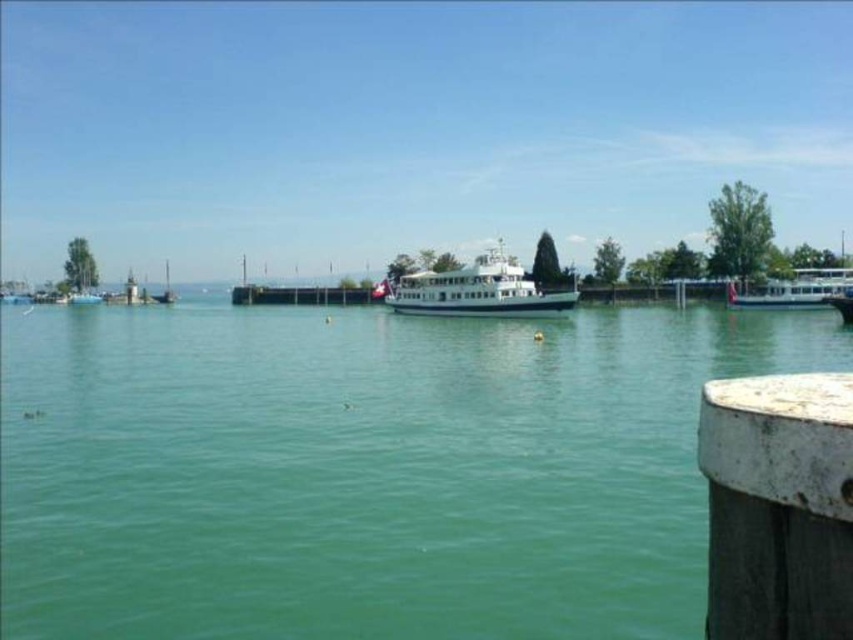
Question: In this image, where is green water at center located relative to white weathered wood at lower right?

Choices:
 (A) right
 (B) left

Answer: (B)

Question: Which point is farther from the camera taking this photo?

Choices:
 (A) (244, 620)
 (B) (171, 298)
 (C) (838, 294)

Answer: (B)

Question: Among these points, which one is farthest from the camera?

Choices:
 (A) (172, 296)
 (B) (245, 536)
 (C) (480, 312)
 (D) (758, 419)

Answer: (A)

Question: Which object is farther from the camera taking this photo?

Choices:
 (A) white glossy ferry at center
 (B) green water at center
 (C) white weathered wood at lower right
 (D) white glossy sailboat at left

Answer: (D)

Question: Can you confirm if white glossy ferry at center is positioned below white glossy boat at right?

Choices:
 (A) yes
 (B) no

Answer: (B)

Question: Can you confirm if green water at center is thinner than white glossy boat at right?

Choices:
 (A) yes
 (B) no

Answer: (B)